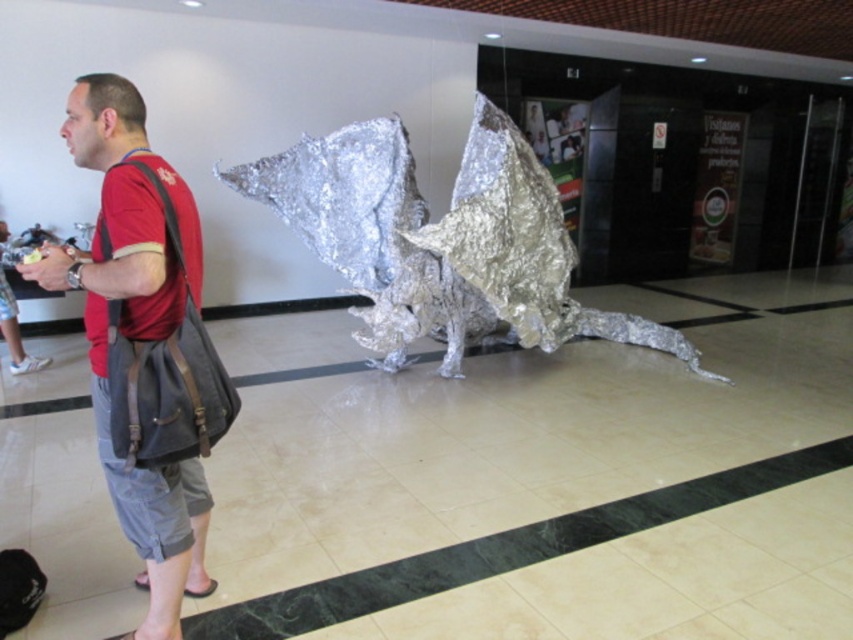
Question: Which point is farther to the camera?

Choices:
 (A) shiny metallic dragon at center
 (B) red cotton t-shirt at left

Answer: (A)

Question: Is shiny metallic dragon at center to the right of red cotton t-shirt at left from the viewer's perspective?

Choices:
 (A) no
 (B) yes

Answer: (B)

Question: Which of the following is the closest to the observer?

Choices:
 (A) shiny metallic dragon at center
 (B) red cotton t-shirt at left

Answer: (B)

Question: In this image, where is shiny metallic dragon at center located relative to red cotton t-shirt at left?

Choices:
 (A) left
 (B) right

Answer: (B)

Question: Does shiny metallic dragon at center have a greater width compared to red cotton t-shirt at left?

Choices:
 (A) yes
 (B) no

Answer: (A)